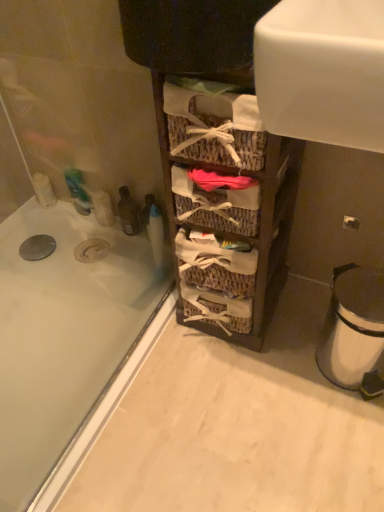
Question: Is white glossy bathtub at lower left aimed at white metallic trash can at lower right?

Choices:
 (A) no
 (B) yes

Answer: (A)

Question: Are white glossy bathtub at lower left and white metallic trash can at lower right far apart?

Choices:
 (A) no
 (B) yes

Answer: (A)

Question: From a real-world perspective, is white glossy bathtub at lower left positioned over white metallic trash can at lower right based on gravity?

Choices:
 (A) yes
 (B) no

Answer: (B)

Question: Is white glossy bathtub at lower left to the right of white metallic trash can at lower right from the viewer's perspective?

Choices:
 (A) no
 (B) yes

Answer: (A)

Question: From a real-world perspective, is white glossy bathtub at lower left below white metallic trash can at lower right?

Choices:
 (A) yes
 (B) no

Answer: (A)

Question: Can you confirm if white glossy bathtub at lower left is positioned to the left of white metallic trash can at lower right?

Choices:
 (A) yes
 (B) no

Answer: (A)

Question: Is woven wood baskets at center bigger than white glossy bathtub at lower left?

Choices:
 (A) yes
 (B) no

Answer: (A)

Question: Considering the relative positions of woven wood baskets at center and white glossy bathtub at lower left in the image provided, is woven wood baskets at center to the left of white glossy bathtub at lower left from the viewer's perspective?

Choices:
 (A) no
 (B) yes

Answer: (A)

Question: From a real-world perspective, is woven wood baskets at center physically below white glossy bathtub at lower left?

Choices:
 (A) no
 (B) yes

Answer: (A)

Question: Is woven wood baskets at center closer to the viewer compared to white glossy bathtub at lower left?

Choices:
 (A) no
 (B) yes

Answer: (B)

Question: Does woven wood baskets at center have a greater height compared to white glossy bathtub at lower left?

Choices:
 (A) no
 (B) yes

Answer: (B)

Question: Can you confirm if woven wood baskets at center is wider than white glossy bathtub at lower left?

Choices:
 (A) yes
 (B) no

Answer: (B)

Question: From a real-world perspective, is white metallic trash can at lower right under woven wood baskets at center?

Choices:
 (A) no
 (B) yes

Answer: (B)